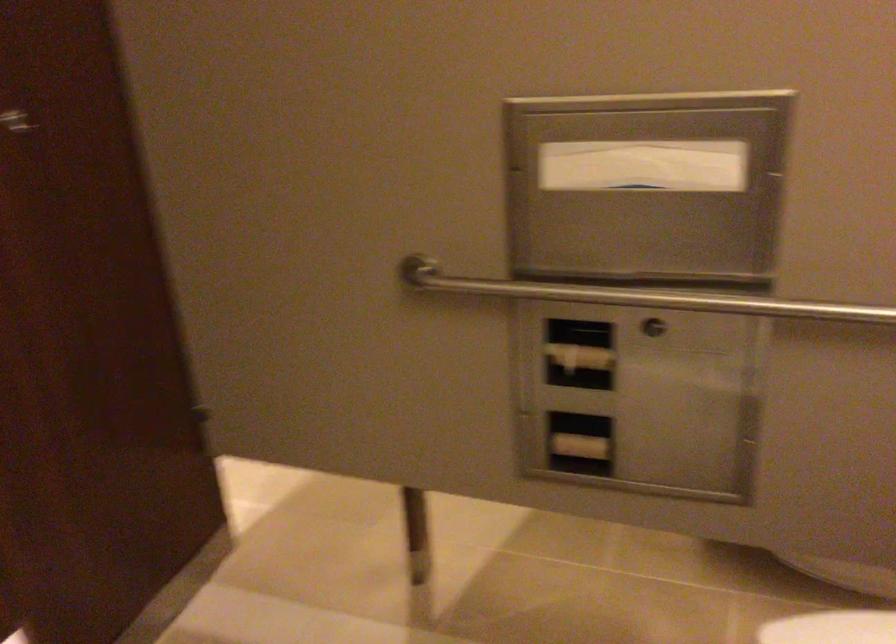
Identify the location of paper from dispenser. This screenshot has width=896, height=644. (643, 166).